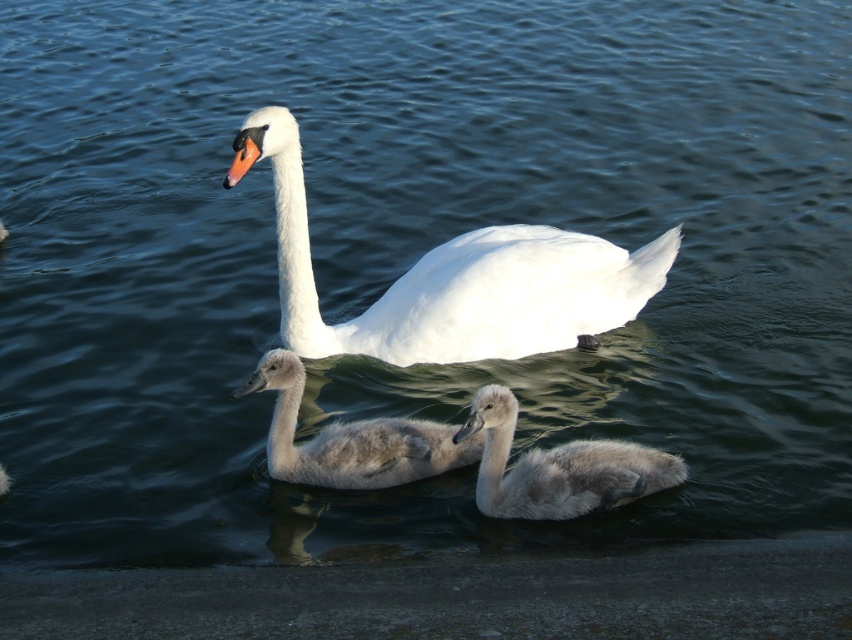
You are a GUI agent. You are given a task and a screenshot of the screen. Output one action in this format:
    pyautogui.click(x=<x>, y=<y>)
    Task: Click on the gray fluffy swan at center
    This screenshot has width=852, height=640.
    Given the screenshot: What is the action you would take?
    pyautogui.click(x=557, y=467)

Who is shorter, gray fluffy swan at center or gray downy cygnet at center?

gray fluffy swan at center

Identify the location of gray fluffy swan at center. (557, 467).

Which is behind, point (538, 284) or point (626, 460)?

Positioned behind is point (538, 284).

Does white glossy swan at center have a lesser width compared to gray fluffy swan at center?

No, white glossy swan at center is not thinner than gray fluffy swan at center.

Find the location of a particular element. white glossy swan at center is located at coordinates (453, 278).

Does white glossy swan at center lie behind gray downy cygnet at center?

That is True.

Is point (494, 339) less distant than point (389, 456)?

No, it is not.

Identify the location of white glossy swan at center. This screenshot has width=852, height=640. coord(453,278).